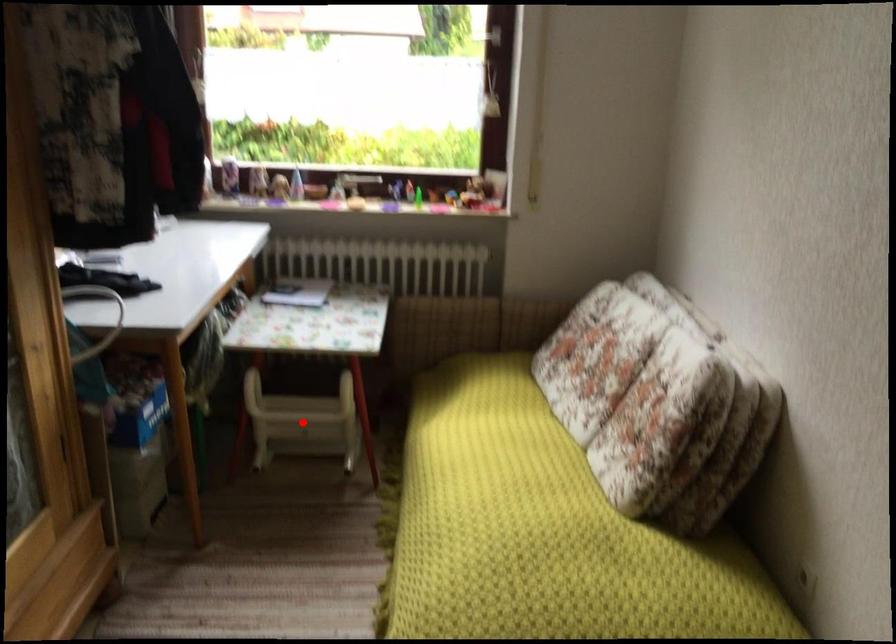
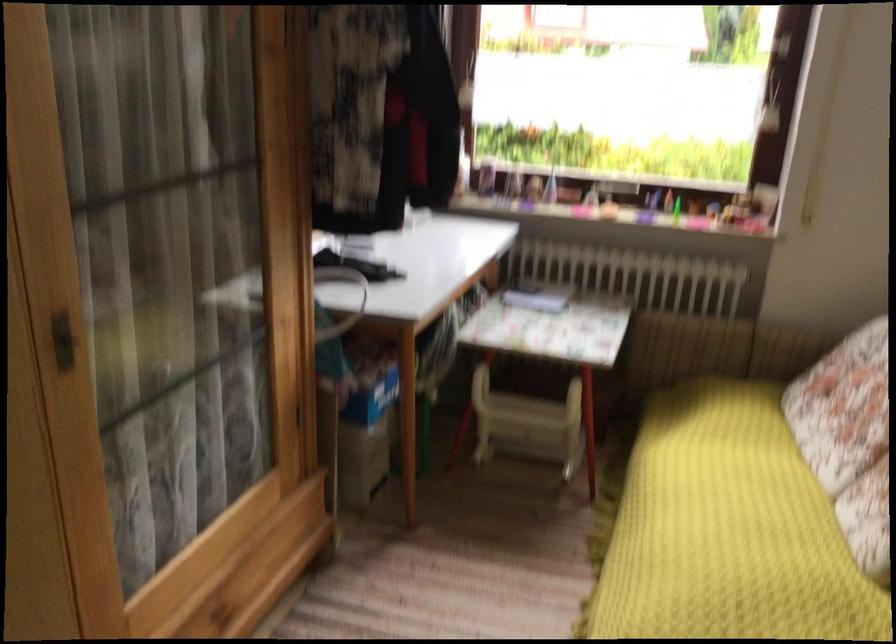
Find the pixel in the second image that matches the highlighted location in the first image.

(528, 424)